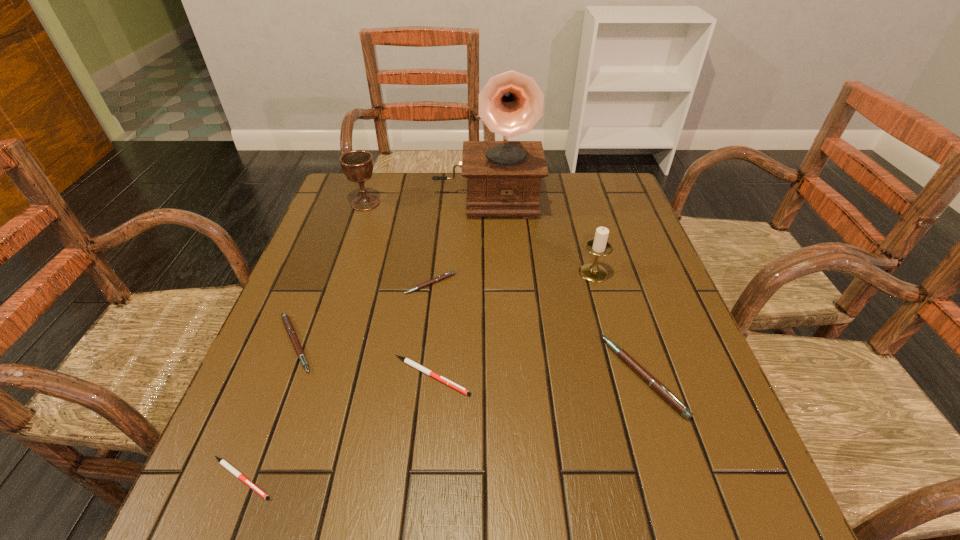
Locate an element on the screen. The height and width of the screenshot is (540, 960). the farther white pen is located at coordinates (406, 360).

The height and width of the screenshot is (540, 960). Identify the location of the bigger white pen. (406, 360).

Where is `the left white pen`? Image resolution: width=960 pixels, height=540 pixels. the left white pen is located at coordinates (230, 468).

Where is `the smaller white pen`? This screenshot has width=960, height=540. the smaller white pen is located at coordinates (230, 468).

What are the coordinates of `vacant point located on the horn of the brown record player` in the screenshot? It's located at (488, 313).

Identify the location of free space located 0.150m on the front of the chalice. (351, 245).

Find the location of `vacant space located on the front of the white candle holder`. vacant space located on the front of the white candle holder is located at coordinates (629, 401).

Where is `free space located 0.330m at the nib of the biggest pink pen`? free space located 0.330m at the nib of the biggest pink pen is located at coordinates (442, 376).

Identify the location of vacant space situated 0.210m at the nib of the biggest pink pen. (503, 376).

Image resolution: width=960 pixels, height=540 pixels. In order to click on vacant space located at the nib of the biggest pink pen in this screenshot , I will do `click(426, 376)`.